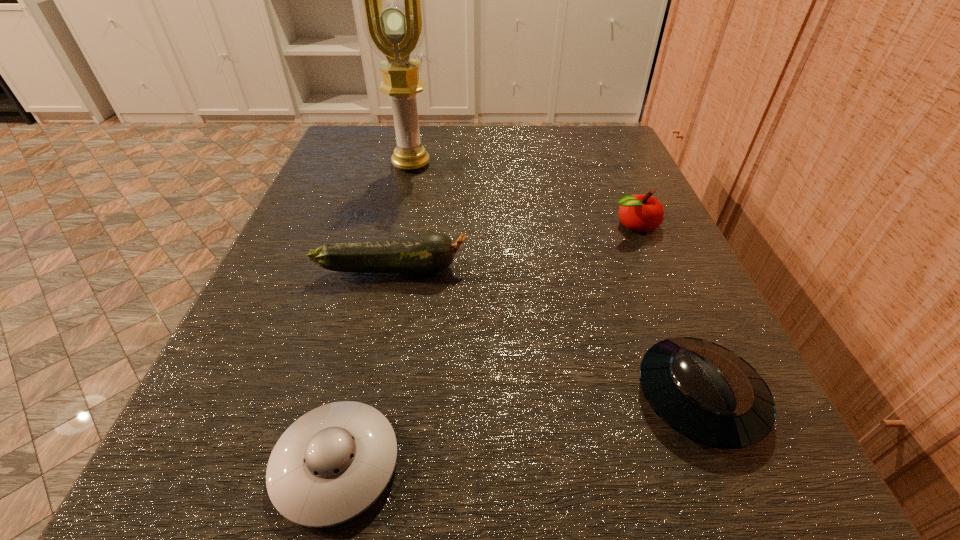
This screenshot has height=540, width=960. What are the coordinates of `free space between the third farthest object and the award` in the screenshot? It's located at (402, 217).

Where is `vacant space that is in between the right saucer and the shorter saucer`? The height and width of the screenshot is (540, 960). vacant space that is in between the right saucer and the shorter saucer is located at coordinates (517, 431).

Where is `vacant area that lies between the shortest object and the right saucer`? vacant area that lies between the shortest object and the right saucer is located at coordinates (517, 431).

You are a GUI agent. You are given a task and a screenshot of the screen. Output one action in this format:
    pyautogui.click(x=<x>, y=<y>)
    Task: Click on the free space between the left saucer and the award
    
    Given the screenshot: What is the action you would take?
    pyautogui.click(x=373, y=314)

Where is `vacant area that lies between the second farthest object and the farthest object`? This screenshot has width=960, height=540. vacant area that lies between the second farthest object and the farthest object is located at coordinates (522, 194).

Find the location of a particular element. vacant space that is in between the apple and the left saucer is located at coordinates (485, 345).

Identify the location of vacant space that is in between the shorter saucer and the zucchini. The image size is (960, 540). (365, 367).

Where is `free space between the award and the shortest object`? free space between the award and the shortest object is located at coordinates (373, 314).

Locate an element on the screen. The height and width of the screenshot is (540, 960). free spot between the right saucer and the left saucer is located at coordinates (517, 431).

The width and height of the screenshot is (960, 540). Find the location of `object that is the fourth nearest to the right saucer`. object that is the fourth nearest to the right saucer is located at coordinates (392, 0).